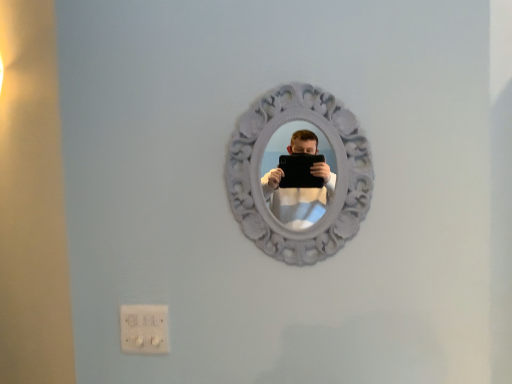
Question: From the image's perspective, is white plastic electric outlet at lower left located above white carved mirror at center?

Choices:
 (A) no
 (B) yes

Answer: (A)

Question: Is white plastic electric outlet at lower left thinner than white carved mirror at center?

Choices:
 (A) no
 (B) yes

Answer: (B)

Question: From the image's perspective, is white plastic electric outlet at lower left under white carved mirror at center?

Choices:
 (A) yes
 (B) no

Answer: (A)

Question: Is white plastic electric outlet at lower left wider than white carved mirror at center?

Choices:
 (A) yes
 (B) no

Answer: (B)

Question: Is white plastic electric outlet at lower left positioned far away from white carved mirror at center?

Choices:
 (A) yes
 (B) no

Answer: (B)

Question: Is white plastic electric outlet at lower left aimed at white carved mirror at center?

Choices:
 (A) yes
 (B) no

Answer: (B)

Question: Is white carved mirror at center oriented towards white plastic electric outlet at lower left?

Choices:
 (A) yes
 (B) no

Answer: (B)

Question: Does white carved mirror at center have a lesser width compared to white plastic electric outlet at lower left?

Choices:
 (A) no
 (B) yes

Answer: (A)

Question: Can you confirm if white carved mirror at center is bigger than white plastic electric outlet at lower left?

Choices:
 (A) yes
 (B) no

Answer: (A)

Question: Can you confirm if white carved mirror at center is positioned to the right of white plastic electric outlet at lower left?

Choices:
 (A) yes
 (B) no

Answer: (A)

Question: From a real-world perspective, is white carved mirror at center located higher than white plastic electric outlet at lower left?

Choices:
 (A) no
 (B) yes

Answer: (B)

Question: Is white carved mirror at center with white plastic electric outlet at lower left?

Choices:
 (A) yes
 (B) no

Answer: (B)

Question: Considering the positions of white carved mirror at center and white plastic electric outlet at lower left in the image, is white carved mirror at center wider or thinner than white plastic electric outlet at lower left?

Choices:
 (A) thin
 (B) wide

Answer: (B)